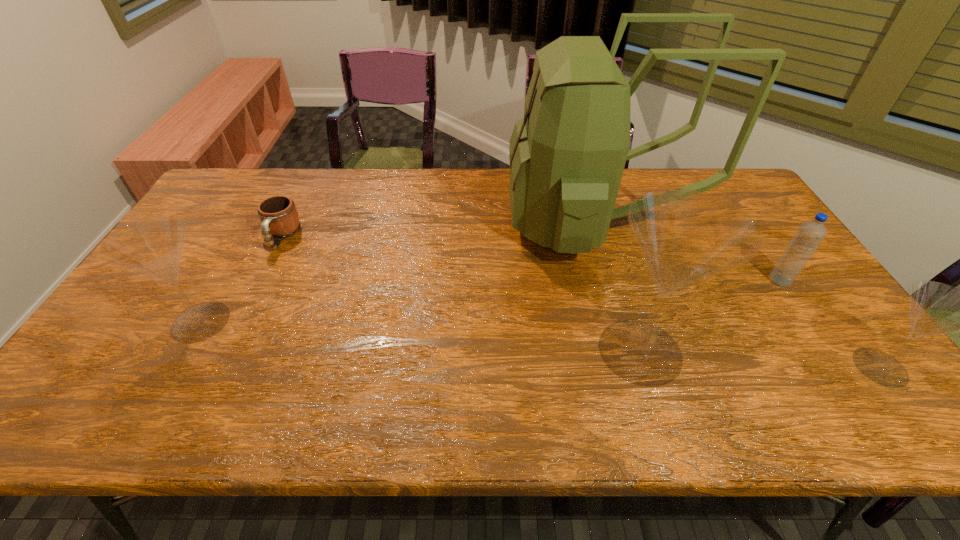
Find the location of a particular element. The width and height of the screenshot is (960, 540). free spot between the shortest flute glass and the leftmost flute glass is located at coordinates (540, 345).

The width and height of the screenshot is (960, 540). Find the location of `vacant area that lies between the leftmost flute glass and the second flute glass from left to right`. vacant area that lies between the leftmost flute glass and the second flute glass from left to right is located at coordinates (420, 336).

The image size is (960, 540). I want to click on empty space between the leftmost flute glass and the second flute glass from right to left, so click(420, 336).

Locate an element on the screen. free space between the leftmost flute glass and the second object from right to left is located at coordinates (491, 301).

Locate an element on the screen. This screenshot has height=540, width=960. empty location between the mug and the shortest flute glass is located at coordinates (581, 302).

I want to click on the fifth closest object to the shortest object, so click(x=935, y=308).

Locate an element on the screen. object that stands as the third closest to the mug is located at coordinates (685, 236).

Locate an element on the screen. flute glass that is the closest one to the second tallest object is located at coordinates (935, 308).

Where is `flute glass identified as the closest to the third farthest object`? Image resolution: width=960 pixels, height=540 pixels. flute glass identified as the closest to the third farthest object is located at coordinates (935, 308).

Locate an element on the screen. The width and height of the screenshot is (960, 540). vacant space that satisfies the following two spatial constraints: 1. on the side of the shortest flute glass with the handle; 2. on the left side of the shortest object is located at coordinates (218, 367).